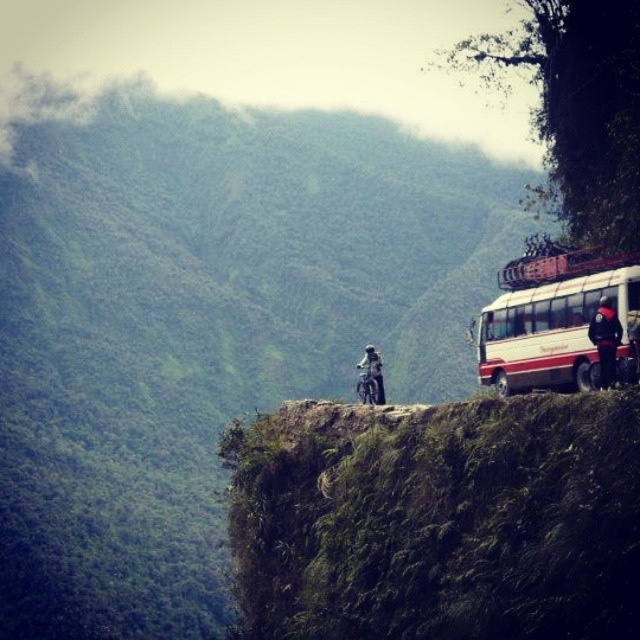
Question: Is the position of white matte bus at right less distant than that of dark gray fabric jacket at center?

Choices:
 (A) no
 (B) yes

Answer: (B)

Question: Can you confirm if white matte bus at right is positioned to the left of dark gray fabric jacket at center?

Choices:
 (A) no
 (B) yes

Answer: (A)

Question: Which object appears farthest from the camera in this image?

Choices:
 (A) white matte bus at right
 (B) green grassy cliff at upper right

Answer: (A)

Question: Which object is closer to the camera taking this photo?

Choices:
 (A) green grassy cliff at upper right
 (B) white matte bus at right
 (C) dark gray fabric jacket at center
 (D) dark blue jacket at right

Answer: (A)

Question: Is green grassy cliff at upper right thinner than dark blue jacket at right?

Choices:
 (A) yes
 (B) no

Answer: (B)

Question: Which point is farther to the camera?

Choices:
 (A) (378, 426)
 (B) (380, 364)
 (C) (541, 273)
 (D) (611, 340)

Answer: (B)